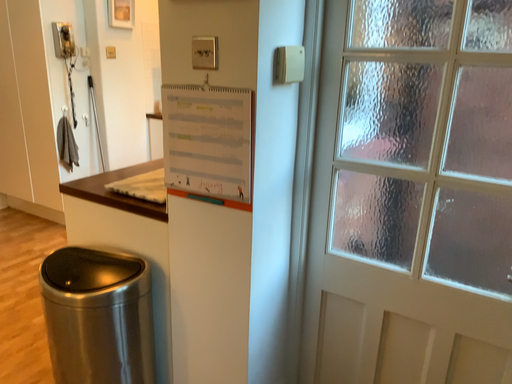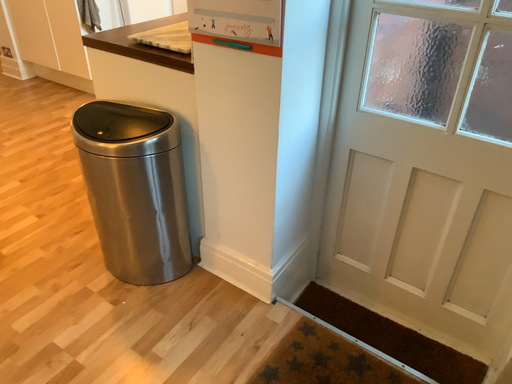
Question: How did the camera likely rotate when shooting the video?

Choices:
 (A) rotated downward
 (B) rotated upward

Answer: (A)